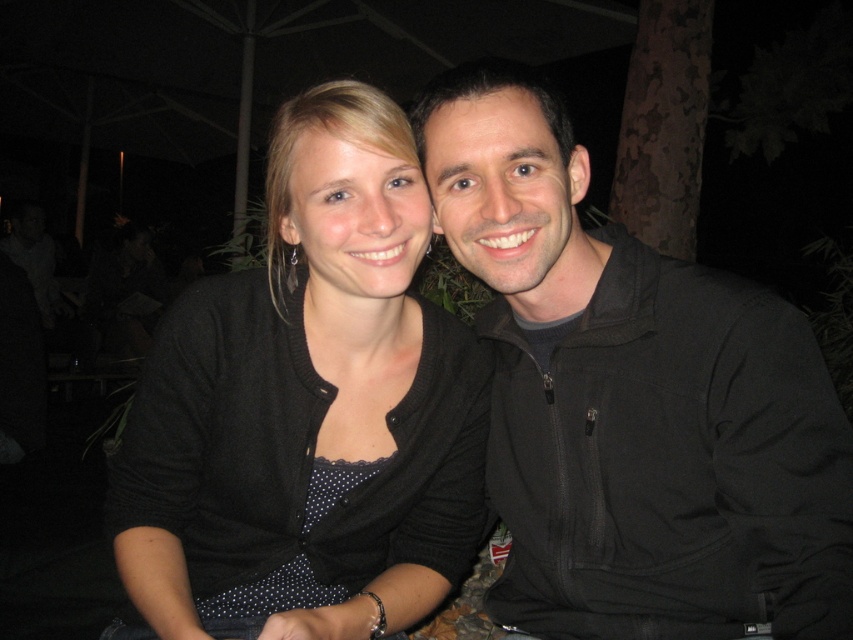
You are a tailor who needs to measure the black softshell jacket at right and the black matte cardigan at center for alterations. Which garment has a smaller size?

The black softshell jacket at right has a smaller size compared to the black matte cardigan at center.

You are a photographer trying to capture a clear shot of both the black softshell jacket at right and the black matte cardigan at center. Since you want to ensure both are fully visible in the frame, which object should you focus on first to avoid cropping either?

The black softshell jacket at right is taller than the black matte cardigan at center, so you should focus on framing the black softshell jacket at right first to ensure its full height is captured without cropping.

You are a photographer trying to capture a closeup of both the black softshell jacket at right and the black matte cardigan at center. Which one should you zoom in on to ensure both fit in the frame without cropping?

The black softshell jacket at right has a lesser width compared to the black matte cardigan at center, so you should zoom in on the black matte cardigan at center to ensure both fit in the frame without cropping.